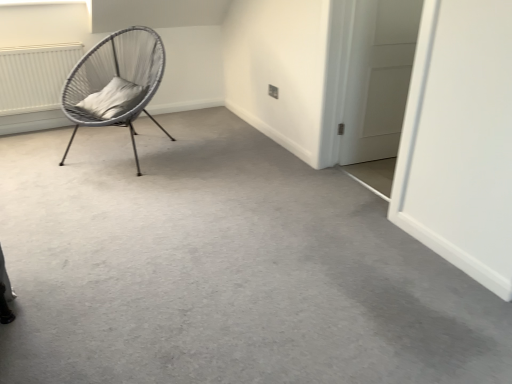
What are the coordinates of `vacant area situated below white textured radiator at upper left (from a real-world perspective)` in the screenshot? It's located at (42, 124).